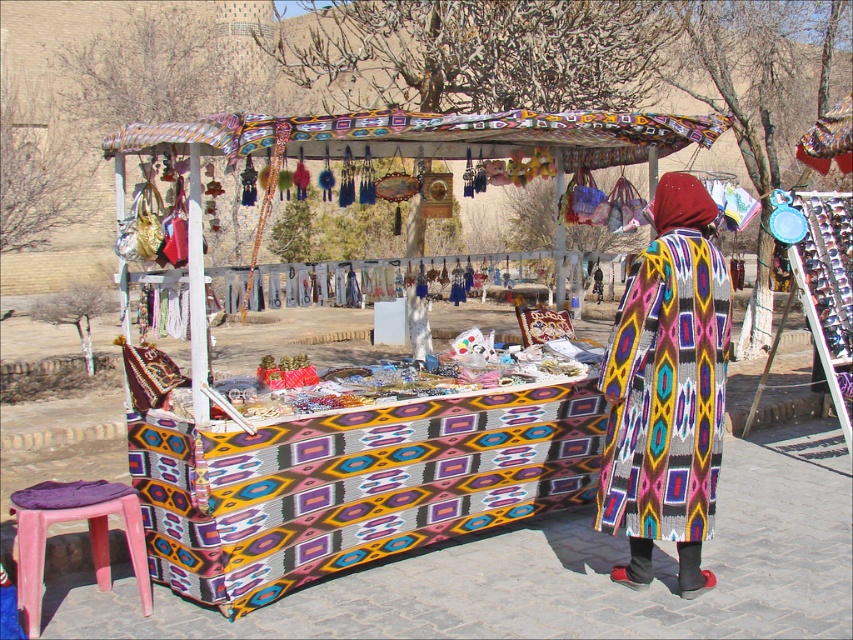
Question: Does knitted fabric stall at center have a lesser width compared to knitted woolen shawl at center?

Choices:
 (A) yes
 (B) no

Answer: (B)

Question: Is knitted woolen shawl at center below pink plastic stool at lower left?

Choices:
 (A) yes
 (B) no

Answer: (B)

Question: Which of the following is the farthest from the observer?

Choices:
 (A) (659, 499)
 (B) (692, 515)
 (C) (91, 488)

Answer: (C)

Question: Is knitted fabric stall at center below pink plastic stool at lower left?

Choices:
 (A) no
 (B) yes

Answer: (A)

Question: Which point is closer to the camera?

Choices:
 (A) knitted fabric stall at center
 (B) pink plastic stool at lower left

Answer: (B)

Question: Which of the following is the farthest from the observer?

Choices:
 (A) (102, 588)
 (B) (460, 144)
 (C) (685, 186)

Answer: (B)